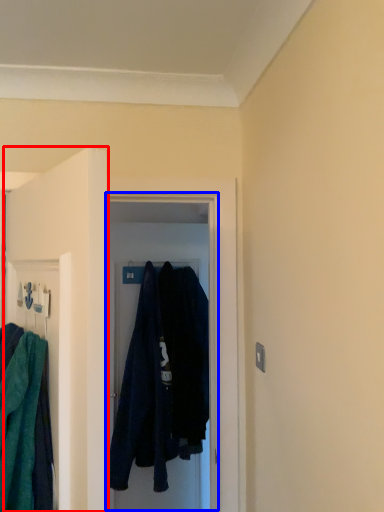
Question: Which of the following is the farthest to the observer, door (highlighted by a red box) or glass door (highlighted by a blue box)?

Choices:
 (A) door
 (B) glass door

Answer: (B)